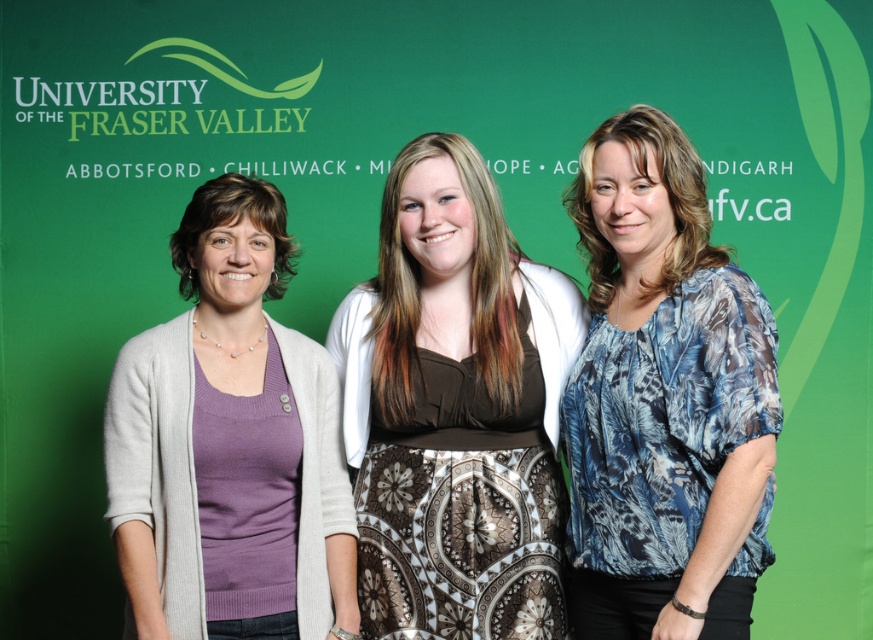
Question: Does brown satin dress at center lie behind blue printed blouse at center?

Choices:
 (A) no
 (B) yes

Answer: (B)

Question: Where is brown satin dress at center located in relation to purple knit sweater at left in the image?

Choices:
 (A) above
 (B) below

Answer: (A)

Question: Observing the image, what is the correct spatial positioning of brown satin dress at center in reference to purple knit sweater at left?

Choices:
 (A) below
 (B) above

Answer: (B)

Question: Estimate the real-world distances between objects in this image. Which object is closer to the brown satin dress at center?

Choices:
 (A) blue printed blouse at center
 (B) purple knit sweater at left

Answer: (A)

Question: Which of the following is the closest to the observer?

Choices:
 (A) brown satin dress at center
 (B) purple knit sweater at left

Answer: (B)

Question: Which is farther from the blue printed blouse at center?

Choices:
 (A) brown satin dress at center
 (B) purple knit sweater at left

Answer: (B)